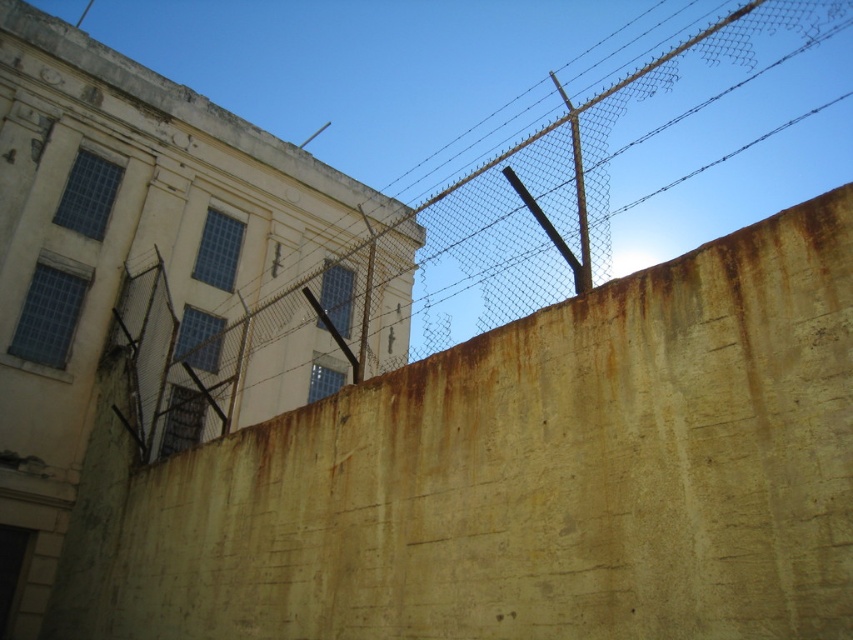
Question: Is rusty concrete wall at lower left to the right of rusty concrete fence at upper right from the viewer's perspective?

Choices:
 (A) no
 (B) yes

Answer: (A)

Question: In this image, where is rusty concrete wall at lower left located relative to rusty concrete fence at upper right?

Choices:
 (A) right
 (B) left

Answer: (B)

Question: Is rusty concrete wall at lower left thinner than rusty concrete fence at upper right?

Choices:
 (A) no
 (B) yes

Answer: (B)

Question: Which point is closer to the camera taking this photo?

Choices:
 (A) (219, 422)
 (B) (299, 589)

Answer: (B)

Question: Which point is closer to the camera?

Choices:
 (A) (544, 365)
 (B) (239, 369)

Answer: (A)